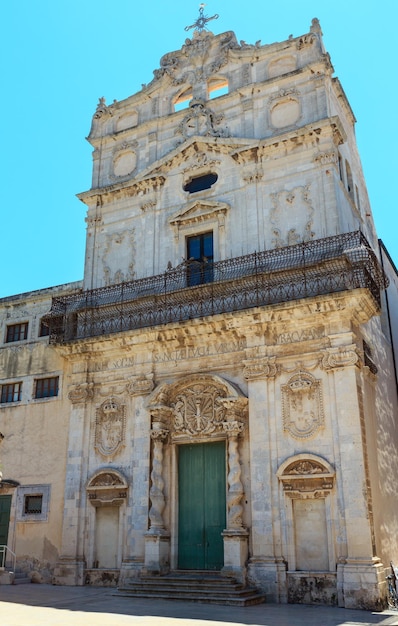
Where is `window`? This screenshot has width=398, height=626. window is located at coordinates (200, 249), (44, 326), (19, 331), (50, 385), (12, 392), (33, 499).